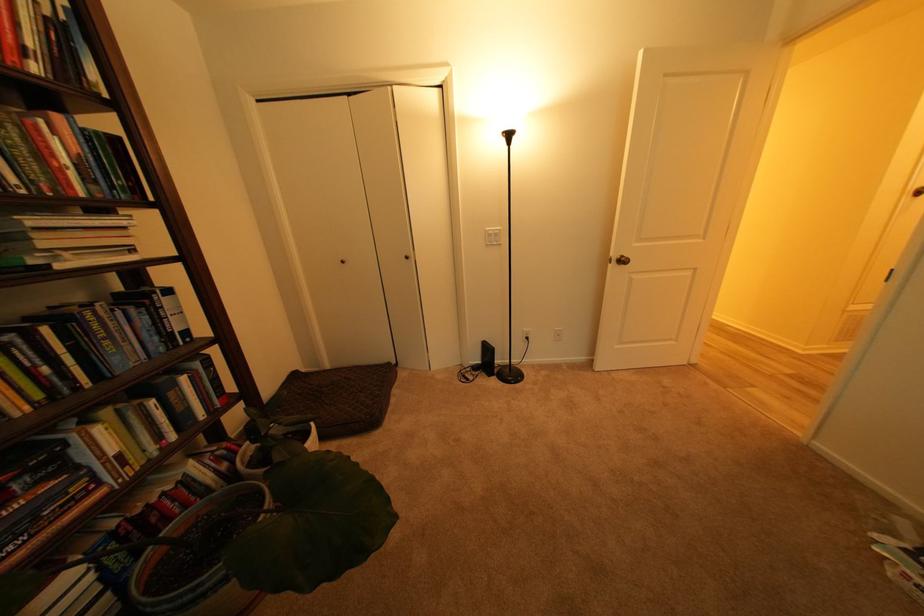
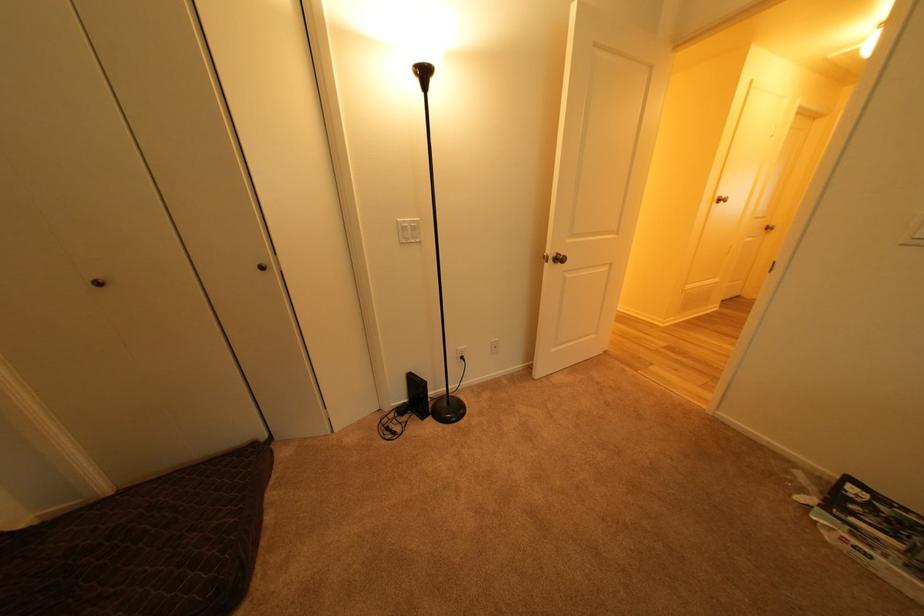
Find the pixel in the second image that matches pixel 500 237 in the first image.

(416, 230)